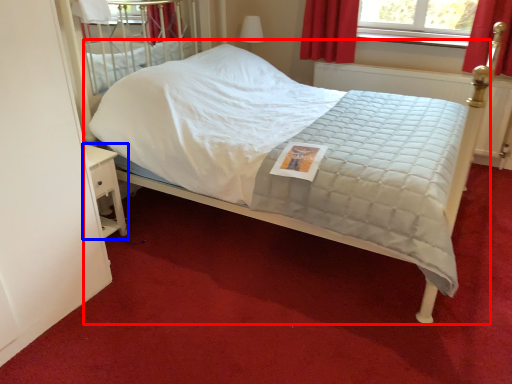
Question: Which of the following is the closest to the observer, bed (highlighted by a red box) or nightstand (highlighted by a blue box)?

Choices:
 (A) bed
 (B) nightstand

Answer: (A)